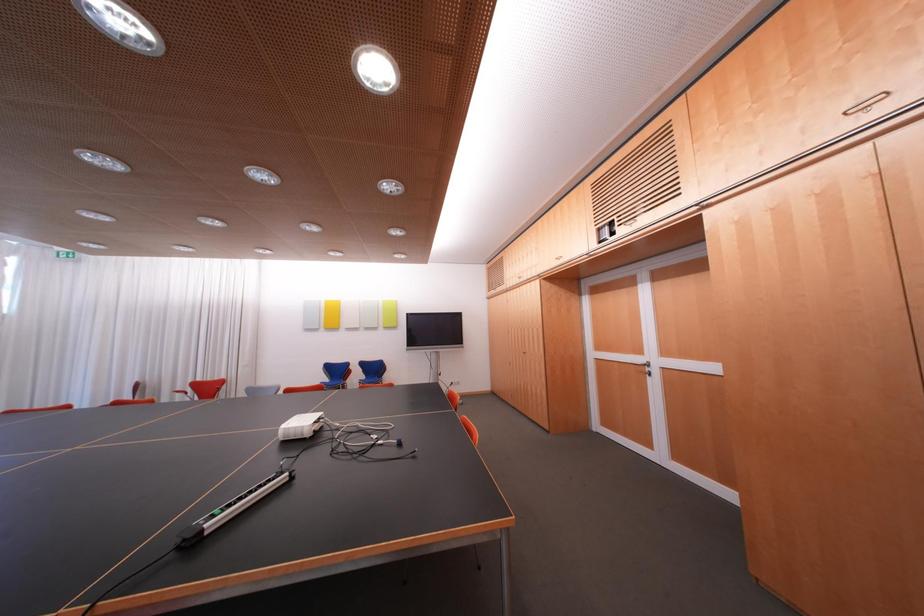
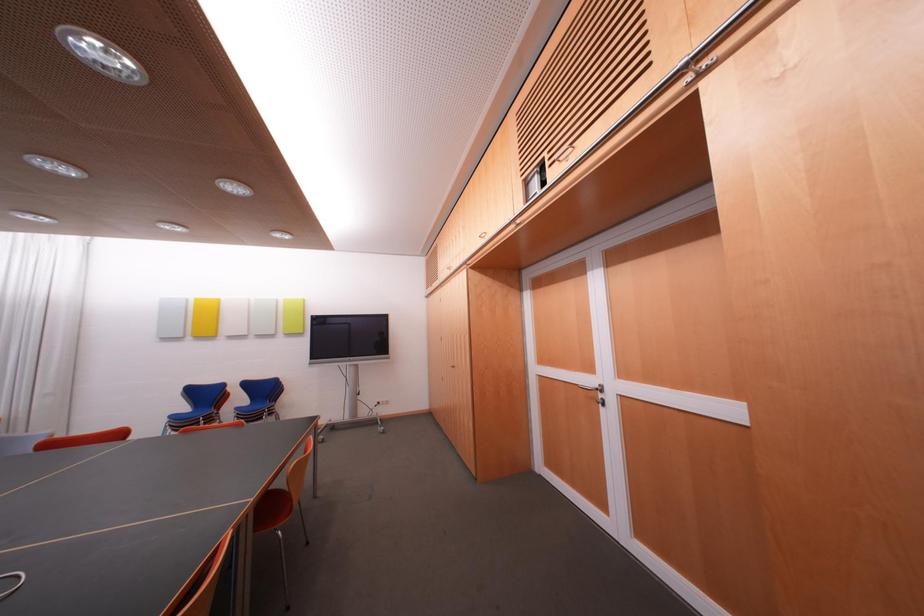
In a continuous first-person perspective shot, in which direction is the camera moving?

The movement direction of the cameraman is right, forward.